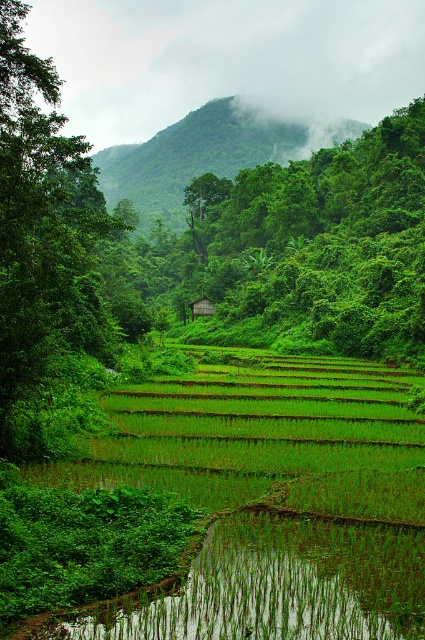
You are planning to set up a picnic area in the green grassy field at center and the wooden hut at center. Which location would allow for a larger picnic setup based on their widths?

The green grassy field at center has a greater width than the wooden hut at center, so it can accommodate a larger picnic setup.

You are a hiker standing at the bottom of the terraced rice paddies. You see the green leafy tree at left and the wooden hut at center. Which object is positioned higher in the landscape?

The green leafy tree at left is positioned higher in the landscape than the wooden hut at center.